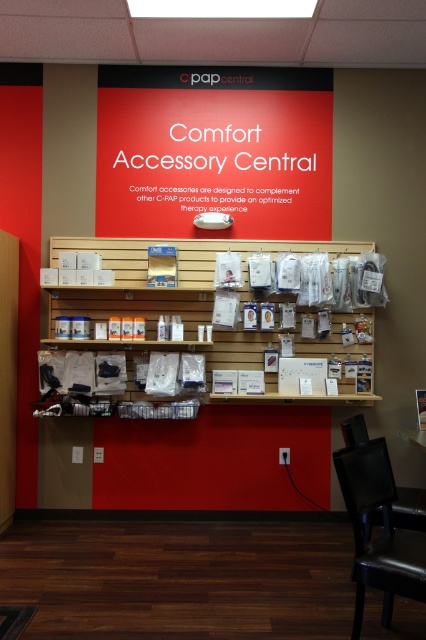
You are a customer in a CPAP accessory store and want to locate two specific points on the wall display. The first point is at coordinates point (405, 579) and the second is at point (399, 493). Which of these points is closer to the viewer?

Point (405, 579) is in front of point (399, 493), so the first point is closer to the viewer.

You are a customer in the store and want to sit down while deciding between the matte plastic bottles at center and the black leather chair at lower right. Which object should you approach first to sit?

The black leather chair at lower right is the only seating option available, so you should approach the black leather chair at lower right first to sit.